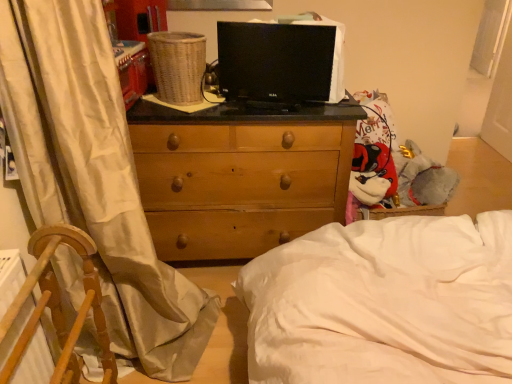
This screenshot has height=384, width=512. What do you see at coordinates (178, 66) in the screenshot? I see `woven brown basket at upper center` at bounding box center [178, 66].

In order to face woven brown basket at upper center, should I rotate leftwards or rightwards?

Turn left approximately 10.323 degrees to face it.

Where is `fluffy plush toy at right`? fluffy plush toy at right is located at coordinates tap(375, 165).

Measure the distance between point (x=279, y=226) and camera.

Point (x=279, y=226) and camera are 6.19 feet apart from each other.

This screenshot has height=384, width=512. Find the location of `white fabric screen door at right`. white fabric screen door at right is located at coordinates (501, 97).

You are a GUI agent. You are given a task and a screenshot of the screen. Output one action in this format:
    pyautogui.click(x=<x>, y=<y>)
    Task: Click on the black glossy tv at center
    
    Given the screenshot: What is the action you would take?
    pyautogui.click(x=280, y=62)

The image size is (512, 384). Describe the element at coordinates (60, 306) in the screenshot. I see `wooden chair at left` at that location.

Where is `white silk curtain at left`? white silk curtain at left is located at coordinates (94, 177).

Who is bigger, fluffy plush toy at right or woven brown basket at upper center?

fluffy plush toy at right.

Is fluffy plush toy at right in front of or behind woven brown basket at upper center in the image?

fluffy plush toy at right is behind woven brown basket at upper center.

Can you tell me how much fluffy plush toy at right and woven brown basket at upper center differ in facing direction?

The angle between the facing direction of fluffy plush toy at right and the facing direction of woven brown basket at upper center is 9.39e-06 degrees.

Considering the sizes of objects fluffy plush toy at right and woven brown basket at upper center in the image provided, who is shorter, fluffy plush toy at right or woven brown basket at upper center?

Standing shorter between the two is woven brown basket at upper center.

Considering the relative positions of wooden chair at left and woven brown basket at upper center in the image provided, is wooden chair at left to the left of woven brown basket at upper center from the viewer's perspective?

Yes.

From a real-world perspective, between wooden chair at left and woven brown basket at upper center, who is vertically higher?

woven brown basket at upper center.

Which of these two, wooden chair at left or woven brown basket at upper center, is wider?

Wider between the two is wooden chair at left.

In the scene shown: From the image's perspective, which one is positioned higher, wooden chair at left or woven brown basket at upper center?

woven brown basket at upper center is shown above in the image.

Does white soft bed at center lie behind white fabric screen door at right?

No.

From the picture: From a real-world perspective, between white soft bed at center and white fabric screen door at right, who is vertically lower?

white soft bed at center.

Is white soft bed at center oriented away from white fabric screen door at right?

No.

Choose the correct answer: Is white soft bed at center inside white fabric screen door at right or outside it?

white soft bed at center is spatially situated outside white fabric screen door at right.

Which is less distant, [500,53] or [376,172]?

Point [500,53] appears to be farther away from the viewer than point [376,172].

Could fluffy plush toy at right be considered to be inside white fabric screen door at right?

Actually, fluffy plush toy at right is outside white fabric screen door at right.

How distant is white fabric screen door at right from fluffy plush toy at right?

A distance of 4.95 feet exists between white fabric screen door at right and fluffy plush toy at right.

Is white fabric screen door at right aimed at fluffy plush toy at right?

No, white fabric screen door at right does not turn towards fluffy plush toy at right.

Is white fabric screen door at right wider than black glossy tv at center?

Indeed, white fabric screen door at right has a greater width compared to black glossy tv at center.

Considering the sizes of objects white fabric screen door at right and black glossy tv at center in the image provided, who is shorter, white fabric screen door at right or black glossy tv at center?

black glossy tv at center.

Considering the points (511, 13) and (280, 80), which point is in front, point (511, 13) or point (280, 80)?

Positioned in front is point (280, 80).

Is white fabric screen door at right far from black glossy tv at center?

That's right, there is a large distance between white fabric screen door at right and black glossy tv at center.

Between point (70, 351) and point (364, 159), which one is positioned in front?

The point (70, 351) is closer.

From the picture: Which object is closer to the camera taking this photo, wooden chair at left or fluffy plush toy at right?

wooden chair at left is in front.

Considering the relative positions of wooden chair at left and fluffy plush toy at right in the image provided, is wooden chair at left to the left or to the right of fluffy plush toy at right?

wooden chair at left is to the left of fluffy plush toy at right.

Between wooden chair at left and fluffy plush toy at right, which one has more height?

wooden chair at left is taller.

Is wooden chest of drawers at center not close to wooden chair at left?

They are positioned close to each other.

Which is more to the right, wooden chest of drawers at center or wooden chair at left?

Positioned to the right is wooden chest of drawers at center.

From the image's perspective, which one is positioned lower, wooden chest of drawers at center or wooden chair at left?

wooden chair at left.

Is wooden chest of drawers at center looking in the opposite direction of wooden chair at left?

wooden chest of drawers at center is not turned away from wooden chair at left.

I want to click on toy on the right of the woven brown basket at upper center, so click(375, 165).

The width and height of the screenshot is (512, 384). Identify the location of basket above the wooden chair at left (from the image's perspective). (178, 66).

Based on their spatial positions, is black glossy tv at center or white soft bed at center further from white silk curtain at left?

black glossy tv at center.

From the image, which object appears to be nearer to wooden chest of drawers at center, white fabric screen door at right or white soft bed at center?

white soft bed at center is closer to wooden chest of drawers at center.

When comparing their distances from woven brown basket at upper center, does white soft bed at center or wooden chest of drawers at center seem closer?

Among the two, wooden chest of drawers at center is located nearer to woven brown basket at upper center.

When comparing their distances from white soft bed at center, does black glossy tv at center or woven brown basket at upper center seem closer?

black glossy tv at center.

Based on their spatial positions, is wooden chair at left or black glossy tv at center further from fluffy plush toy at right?

wooden chair at left lies further to fluffy plush toy at right than the other object.

Looking at the image, which one is located further to white soft bed at center, black glossy tv at center or fluffy plush toy at right?

Based on the image, fluffy plush toy at right appears to be further to white soft bed at center.

Estimate the real-world distances between objects in this image. Which object is further from wooden chest of drawers at center, woven brown basket at upper center or white silk curtain at left?

white silk curtain at left is positioned further to the anchor wooden chest of drawers at center.

When comparing their distances from white fabric screen door at right, does woven brown basket at upper center or fluffy plush toy at right seem closer?

Among the two, fluffy plush toy at right is located nearer to white fabric screen door at right.

Locate an element on the screen. Image resolution: width=512 pixels, height=384 pixels. toy located between white silk curtain at left and white fabric screen door at right in the left-right direction is located at coordinates (375, 165).

Find the location of a particular element. This screenshot has height=384, width=512. bed situated between woven brown basket at upper center and white fabric screen door at right from left to right is located at coordinates (384, 303).

This screenshot has height=384, width=512. I want to click on chest of drawers between white silk curtain at left and white fabric screen door at right in the horizontal direction, so click(x=239, y=176).

At what (x,y) coordinates should I click in order to perform the action: click on television that lies between woven brown basket at upper center and white soft bed at center from top to bottom. Please return your answer as a coordinate pair (x, y). Image resolution: width=512 pixels, height=384 pixels. Looking at the image, I should click on (280, 62).